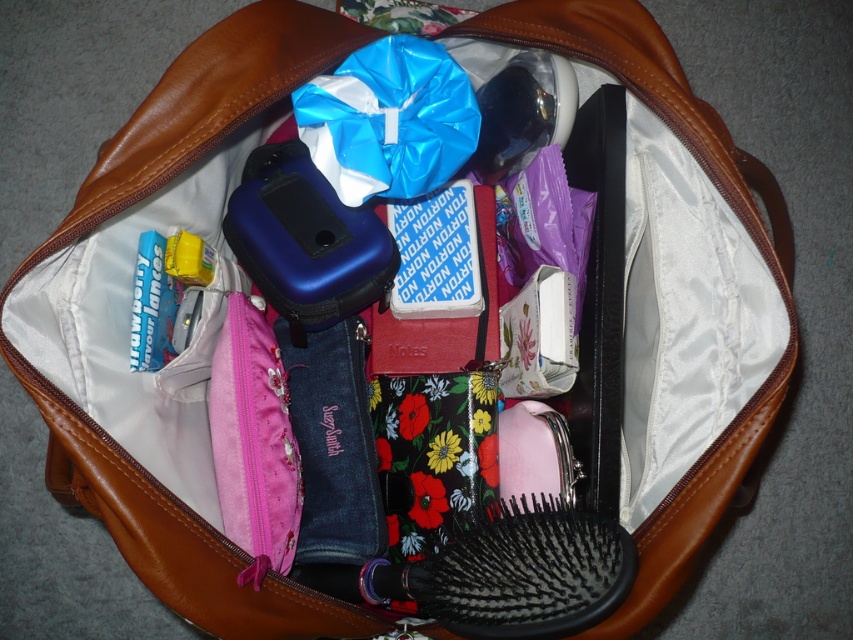
You are holding the open brown leather bag and want to place a new item in the front part of the bag. Which of the two points, point (573, 618) or point (413, 122), is closer to the opening where you can easily access it?

Point (573, 618) is closer to the camera than point (413, 122), so it is closer to the opening and easier to access.

You are organizing your bag and need to know which item takes up more space. Which is larger between the black plastic hairbrush at center and the blue shiny plastic bag at center?

The black plastic hairbrush at center is larger in size than the blue shiny plastic bag at center, so it takes up more space.